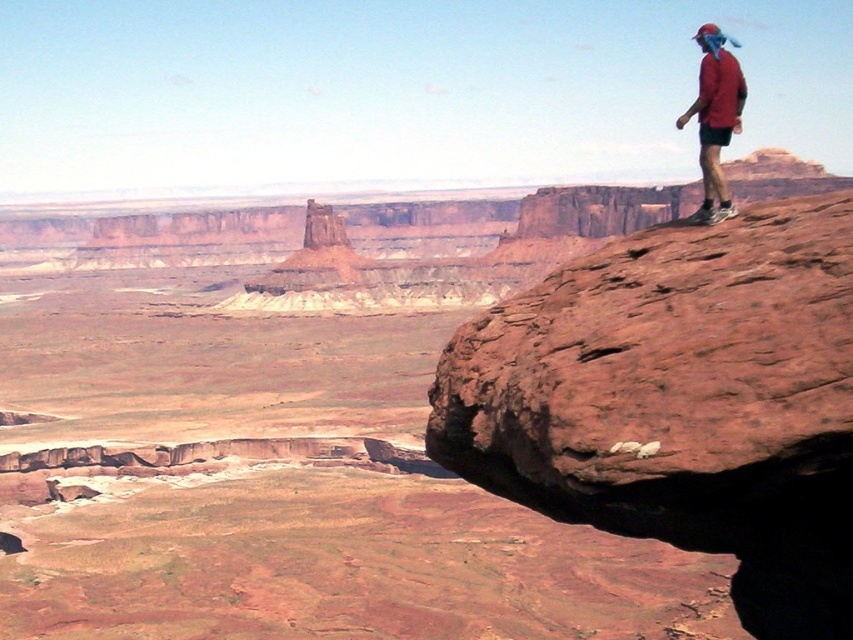
Question: Can you confirm if rusty rock at upper right is wider than red matte shirt at upper right?

Choices:
 (A) yes
 (B) no

Answer: (B)

Question: Can you confirm if rusty rock at upper right is thinner than red matte shirt at upper right?

Choices:
 (A) yes
 (B) no

Answer: (A)

Question: Which point is closer to the camera?

Choices:
 (A) (851, 248)
 (B) (685, 116)

Answer: (A)

Question: Does rusty rock at upper right appear under red matte shirt at upper right?

Choices:
 (A) yes
 (B) no

Answer: (A)